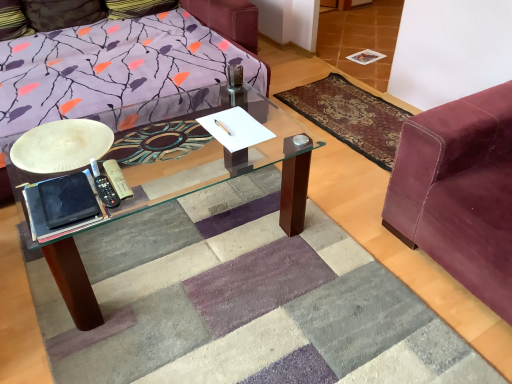
Question: Is velvet maroon couch at right wider or thinner than velvet pillow at upper left?

Choices:
 (A) thin
 (B) wide

Answer: (B)

Question: Choose the correct answer: Is velvet maroon couch at right inside velvet pillow at upper left or outside it?

Choices:
 (A) inside
 (B) outside

Answer: (B)

Question: Considering the real-world distances, which object is closest to the velvet-like burgundy mat at right?

Choices:
 (A) white matte plate at left
 (B) velvet maroon couch at right
 (C) velvet pillow at upper left

Answer: (B)

Question: Which is farther from the velvet maroon couch at right?

Choices:
 (A) white matte plate at left
 (B) velvet-like burgundy mat at right
 (C) velvet pillow at upper left

Answer: (C)